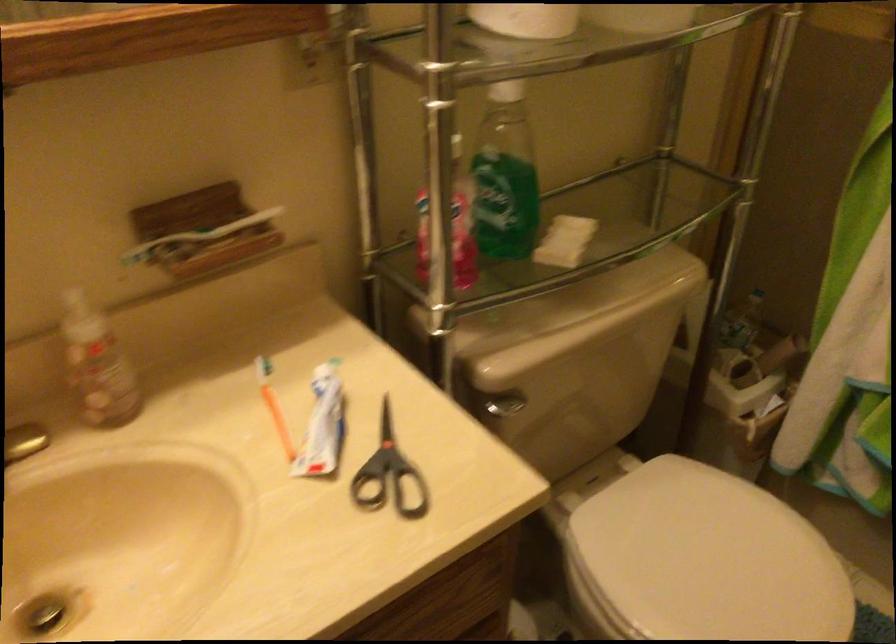
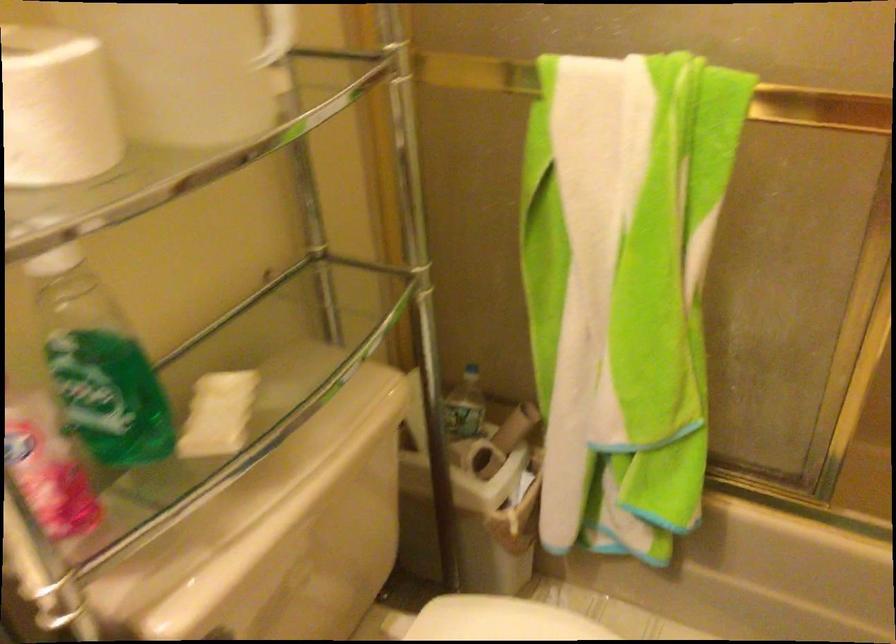
Question: Based on the continuous images, in which direction is the camera rotating? Reply with the corresponding letter.

Choices:
 (A) Left
 (B) Right
 (C) Up
 (D) Down

Answer: (B)